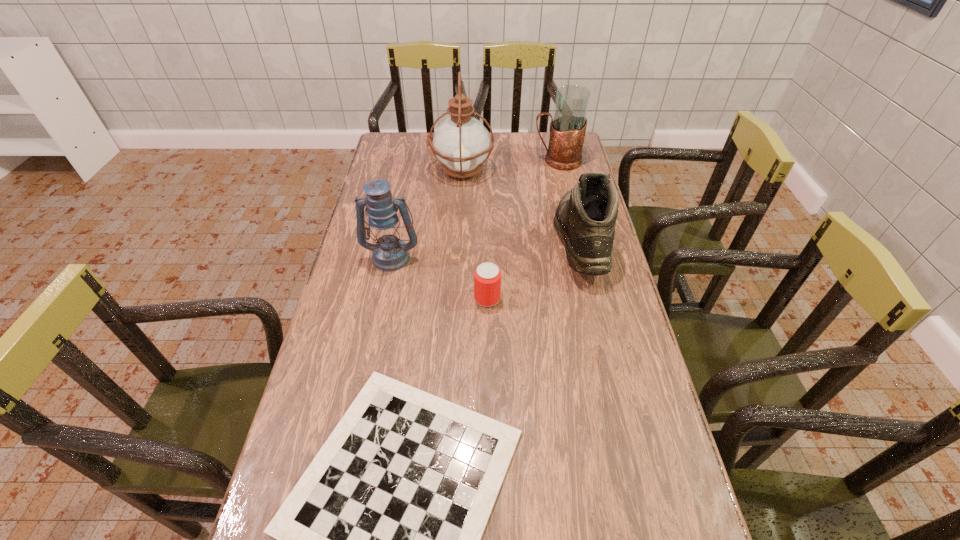
Where is `vacant area at the far left corner of the desktop`? vacant area at the far left corner of the desktop is located at coordinates (403, 154).

Where is `vacant point located between the pitcher and the second shortest object`? The height and width of the screenshot is (540, 960). vacant point located between the pitcher and the second shortest object is located at coordinates (522, 230).

At what (x,y) coordinates should I click in order to perform the action: click on vacant space that is in between the lantern and the pitcher. Please return your answer as a coordinate pair (x, y). Looking at the image, I should click on (474, 208).

This screenshot has width=960, height=540. What are the coordinates of `empty space that is in between the lantern and the ski boot` in the screenshot? It's located at (486, 249).

Where is `vacant space that is in between the ski boot and the lantern`? The width and height of the screenshot is (960, 540). vacant space that is in between the ski boot and the lantern is located at coordinates (486, 249).

Locate an element on the screen. The image size is (960, 540). free space between the beer can and the pitcher is located at coordinates (522, 230).

Identify which object is the fourth nearest to the pitcher. Please provide its 2D coordinates. Your answer should be formatted as a tuple, i.e. [(x, y)], where the tuple contains the x and y coordinates of a point satisfying the conditions above.

[(487, 277)]

Where is `the fourth closest object to the ski boot`? Image resolution: width=960 pixels, height=540 pixels. the fourth closest object to the ski boot is located at coordinates (380, 539).

What are the coordinates of `free space that satisfies the following two spatial constraints: 1. with the handle on the side of the pitcher; 2. on the front-facing side of the lantern` in the screenshot? It's located at (579, 257).

This screenshot has height=540, width=960. Identify the location of blank space that satisfies the following two spatial constraints: 1. with the handle on the side of the pitcher; 2. on the front-facing side of the lantern. (579, 257).